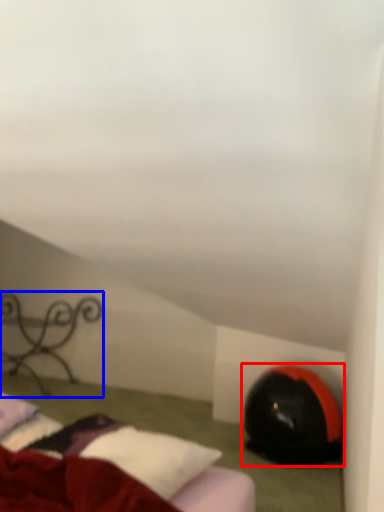
Question: Which object appears farthest to the camera in this image, bean bag chair (highlighted by a red box) or furniture (highlighted by a blue box)?

Choices:
 (A) bean bag chair
 (B) furniture

Answer: (B)